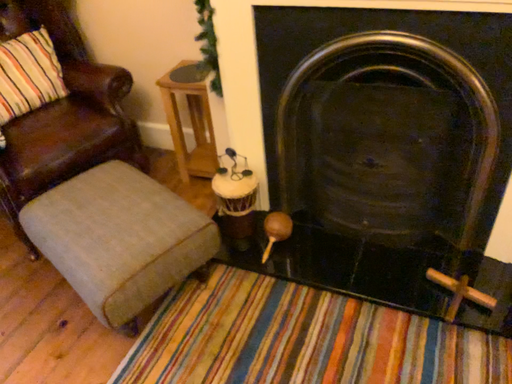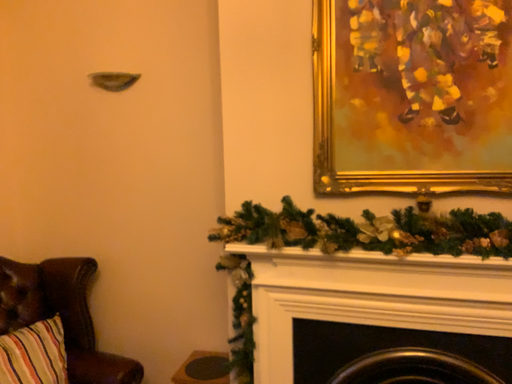
Question: Which way did the camera rotate in the video?

Choices:
 (A) rotated left
 (B) rotated right

Answer: (B)